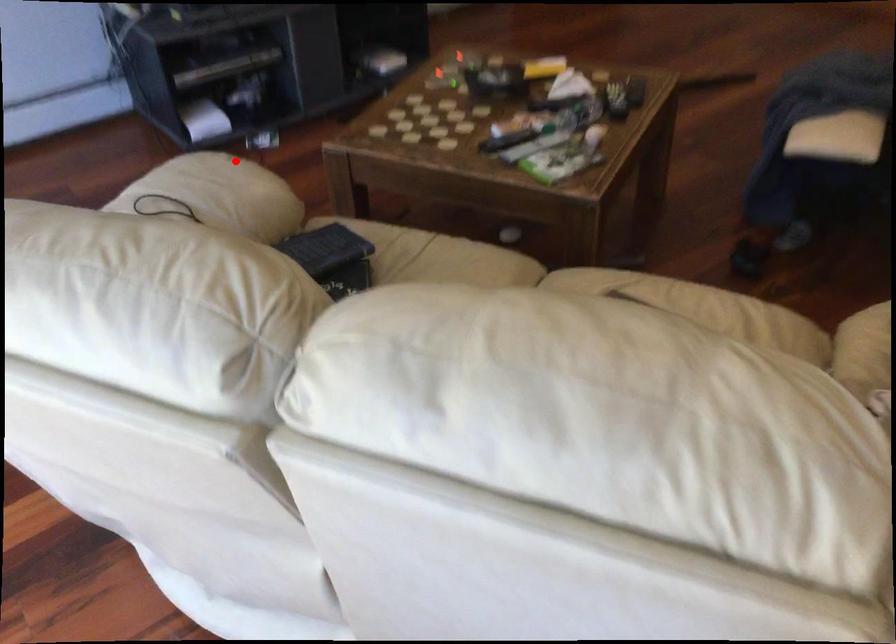
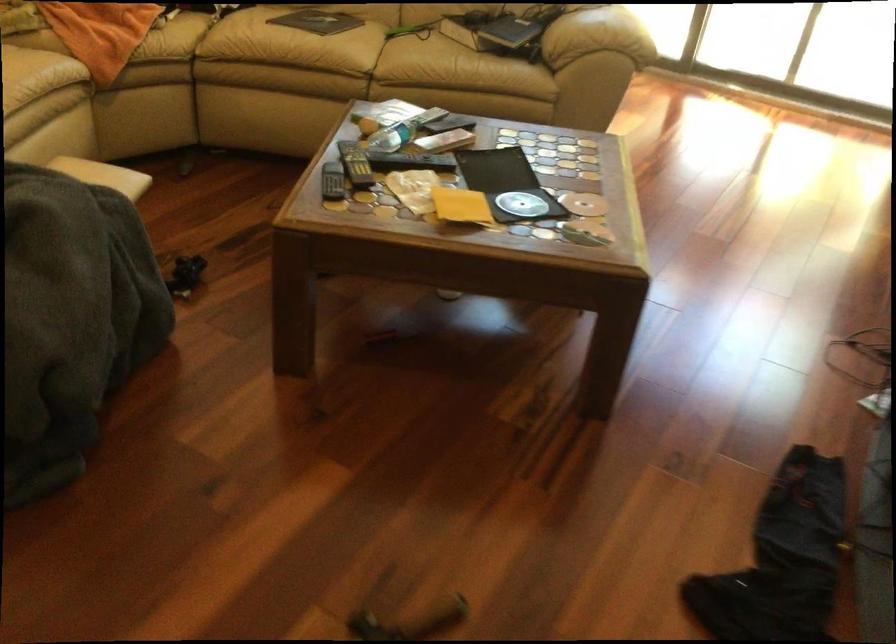
Find the pixel in the second image that matches the highlighted location in the first image.

(597, 35)